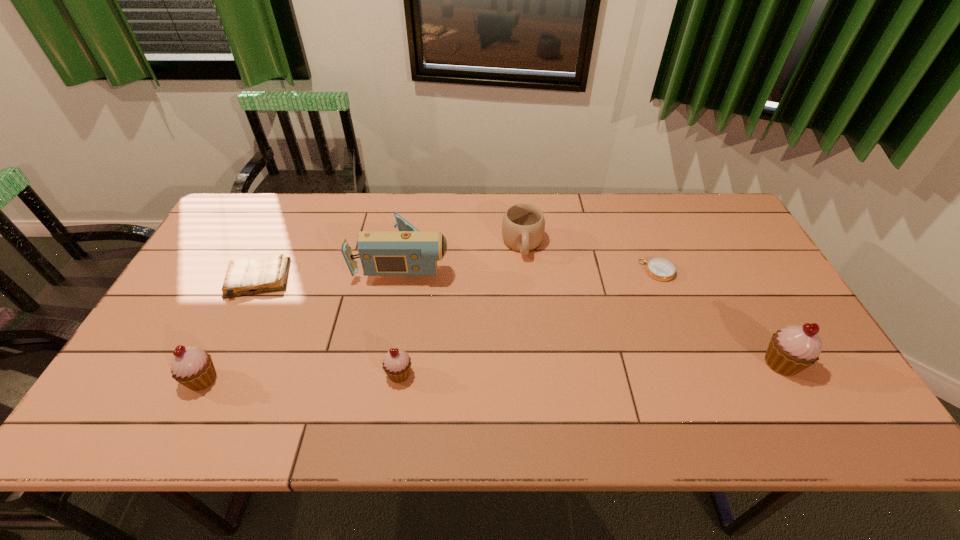
Where is `blank area located on the right of the second shortest cupcake`? blank area located on the right of the second shortest cupcake is located at coordinates (272, 380).

Where is `free region located on the back of the shortest cupcake`? free region located on the back of the shortest cupcake is located at coordinates (413, 279).

The image size is (960, 540). I want to click on vacant area located on the back of the rightmost cupcake, so click(730, 270).

Find the location of a particular element. vacant space located on the side of the fifth object from left to right with the handle is located at coordinates (528, 300).

Locate an element on the screen. The height and width of the screenshot is (540, 960). free location located on the left of the compass is located at coordinates 545,271.

I want to click on free space located on the side of the camcorder with the flip-out screen, so click(x=491, y=259).

Where is `free region located on the right of the second shortest object`? free region located on the right of the second shortest object is located at coordinates (311, 279).

Identify the location of mug at the far edge. The height and width of the screenshot is (540, 960). 523,225.

Locate an element on the screen. The width and height of the screenshot is (960, 540). camcorder positioned at the far edge is located at coordinates (407, 252).

The height and width of the screenshot is (540, 960). Find the location of `cupcake situated at the left edge`. cupcake situated at the left edge is located at coordinates (192, 367).